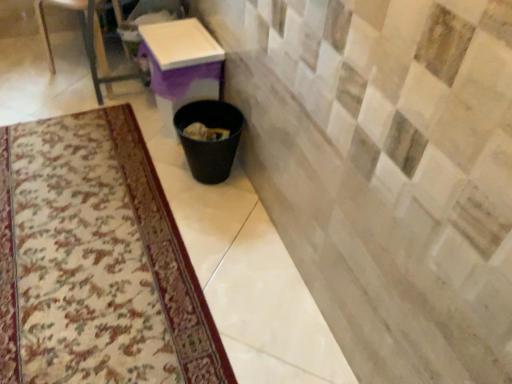
Question: Does white glossy table at center have a lesser width compared to metallic glass table at upper left?

Choices:
 (A) yes
 (B) no

Answer: (A)

Question: Is the position of white glossy table at center more distant than that of metallic glass table at upper left?

Choices:
 (A) yes
 (B) no

Answer: (B)

Question: From a real-world perspective, does white glossy table at center stand above metallic glass table at upper left?

Choices:
 (A) yes
 (B) no

Answer: (B)

Question: Can you confirm if white glossy table at center is taller than metallic glass table at upper left?

Choices:
 (A) no
 (B) yes

Answer: (A)

Question: Does white glossy table at center appear on the left side of metallic glass table at upper left?

Choices:
 (A) yes
 (B) no

Answer: (B)

Question: Would you say black plastic trash can at lower center is inside or outside white glossy table at center?

Choices:
 (A) outside
 (B) inside

Answer: (A)

Question: In the image, is black plastic trash can at lower center positioned in front of or behind white glossy table at center?

Choices:
 (A) behind
 (B) front

Answer: (B)

Question: Is black plastic trash can at lower center to the left or to the right of white glossy table at center in the image?

Choices:
 (A) left
 (B) right

Answer: (B)

Question: Considering the positions of black plastic trash can at lower center and white glossy table at center in the image, is black plastic trash can at lower center bigger or smaller than white glossy table at center?

Choices:
 (A) small
 (B) big

Answer: (A)

Question: Visually, is metallic glass table at upper left positioned to the left or to the right of black plastic trash can at lower center?

Choices:
 (A) right
 (B) left

Answer: (B)

Question: Is point (94, 8) positioned closer to the camera than point (204, 107)?

Choices:
 (A) farther
 (B) closer

Answer: (A)

Question: In the image, is metallic glass table at upper left positioned in front of or behind black plastic trash can at lower center?

Choices:
 (A) behind
 (B) front

Answer: (A)

Question: Considering the positions of metallic glass table at upper left and black plastic trash can at lower center in the image, is metallic glass table at upper left wider or thinner than black plastic trash can at lower center?

Choices:
 (A) wide
 (B) thin

Answer: (A)

Question: Is point click(152, 31) closer or farther from the camera than point click(231, 162)?

Choices:
 (A) farther
 (B) closer

Answer: (A)

Question: Is white glossy table at center inside or outside of black plastic trash can at lower center?

Choices:
 (A) inside
 (B) outside

Answer: (B)